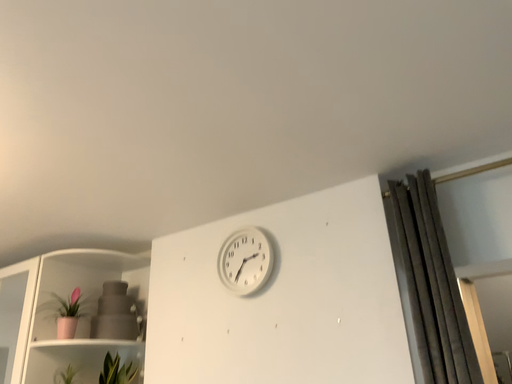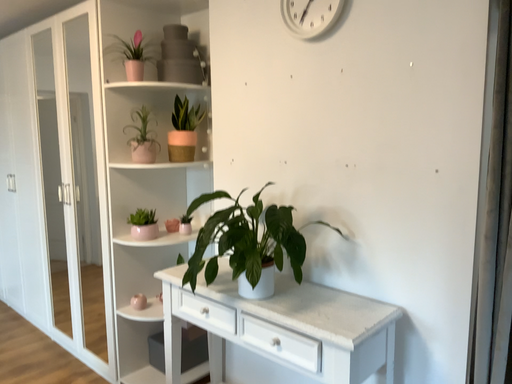
Question: How did the camera likely rotate when shooting the video?

Choices:
 (A) rotated upward
 (B) rotated downward

Answer: (B)